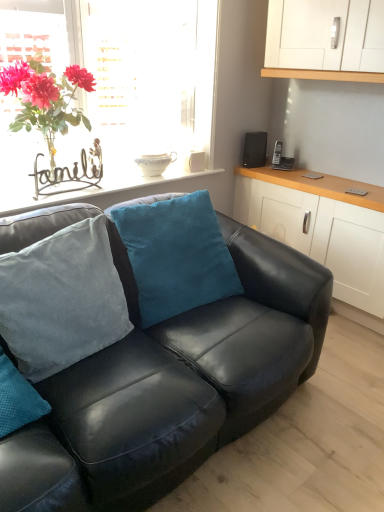
Question: Considering the positions of white ceramic bowl at upper center and velvet blue pillow at center, which is the first pillow in left-to-right order, in the image, is white ceramic bowl at upper center taller or shorter than velvet blue pillow at center, which is the first pillow in left-to-right order,?

Choices:
 (A) tall
 (B) short

Answer: (B)

Question: Relative to velvet blue pillow at center, which is the first pillow in left-to-right order, is white ceramic bowl at upper center in front or behind?

Choices:
 (A) front
 (B) behind

Answer: (B)

Question: Estimate the real-world distances between objects in this image. Which object is closer to the white matte cabinet at right?

Choices:
 (A) white ceramic bowl at upper center
 (B) glass vase at upper left
 (C) velvet blue pillow at center, placed as the second pillow when sorted from right to left
 (D) black leather couch at center
 (E) black matte speaker at upper right

Answer: (E)

Question: Considering the real-world distances, which object is farthest from the teal velvety pillow at center, the first pillow in the right-to-left sequence?

Choices:
 (A) white ceramic bowl at upper center
 (B) matte metal sign at upper left
 (C) white matte cabinet at right
 (D) glass vase at upper left
 (E) velvet blue pillow at center, which is the first pillow in left-to-right order

Answer: (C)